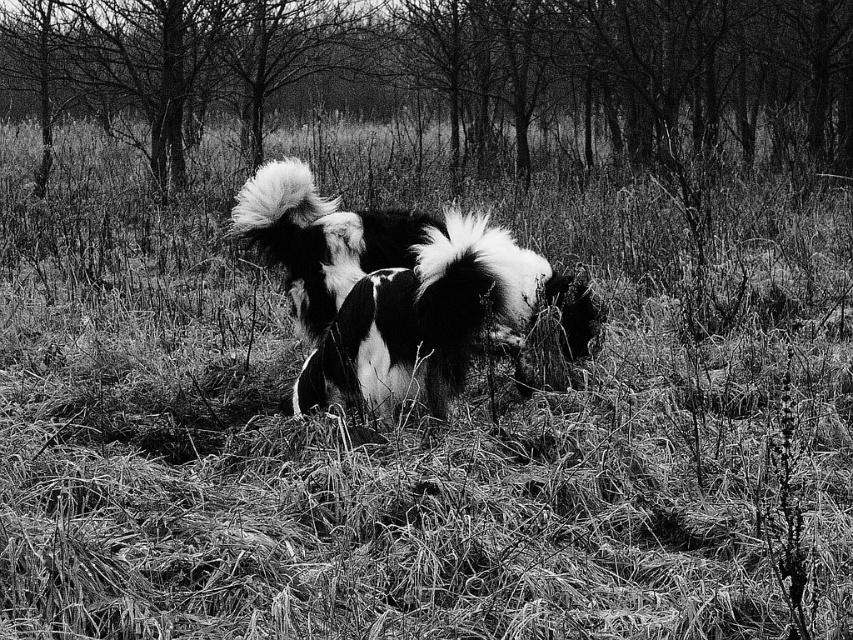
You are a photographer trying to capture a closeup of the smooth bark tree at center. However, the black and white fur dog at center is blocking your view. Can you move the dog to the side so you can get a clear shot of the tree?

The smooth bark tree at center is much taller than the black and white fur dog at center, so you can simply look over the dog to capture the tree without moving it.